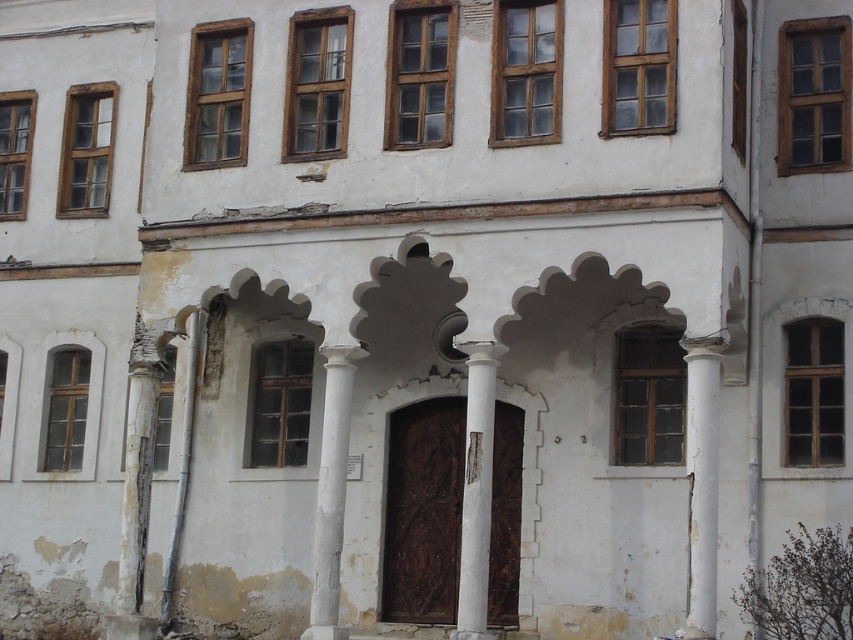
Question: Does white stone column at right have a larger size compared to white smooth column at center?

Choices:
 (A) no
 (B) yes

Answer: (A)

Question: Which of the following is the farthest from the observer?

Choices:
 (A) white smooth column at center
 (B) white stone column at right
 (C) white stone column at center
 (D) white concrete pillar at left

Answer: (D)

Question: Among these objects, which one is nearest to the camera?

Choices:
 (A) white stone column at right
 (B) white concrete pillar at left
 (C) white stone column at center

Answer: (A)

Question: Observing the image, what is the correct spatial positioning of white stone column at right in reference to white stone column at center?

Choices:
 (A) right
 (B) left

Answer: (A)

Question: Does white smooth column at center come behind white concrete pillar at left?

Choices:
 (A) no
 (B) yes

Answer: (A)

Question: Which object appears closest to the camera in this image?

Choices:
 (A) white smooth column at center
 (B) white stone column at center
 (C) white stone column at right
 (D) white concrete pillar at left

Answer: (C)